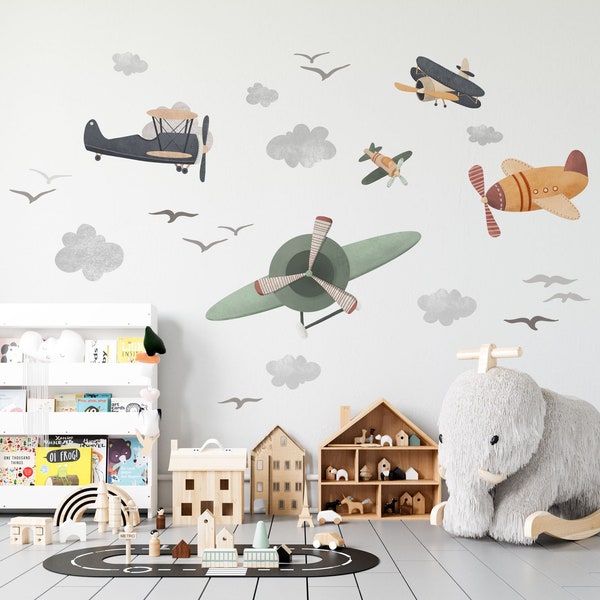
The height and width of the screenshot is (600, 600). I want to click on wall, so click(x=448, y=250).